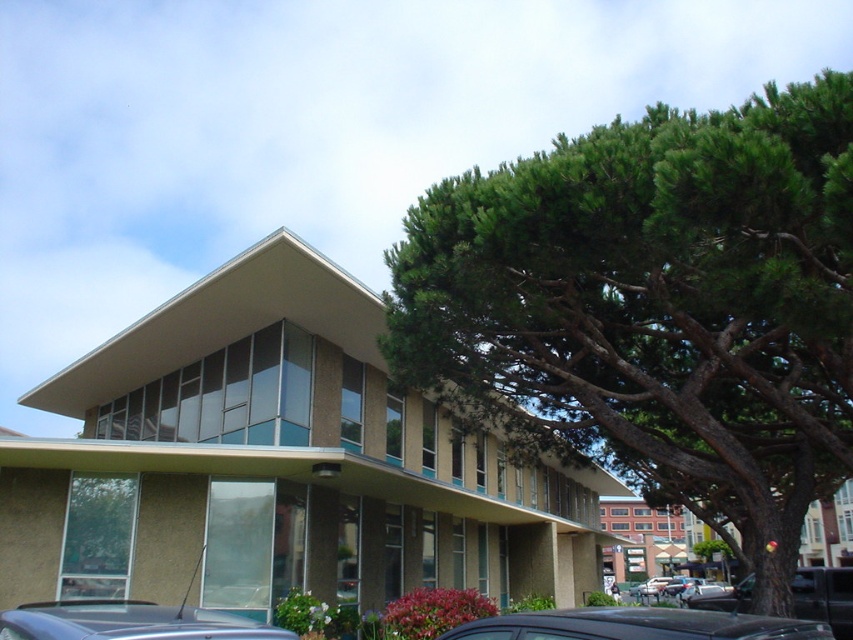
You are a photographer planning to capture the modern building in the image. You notice the green leafy tree at upper right and the black matte car at lower center. Which object takes up more area in the scene?

The black matte car at lower center takes up more area in the scene than the green leafy tree at upper right because the green leafy tree at upper right occupies less space than the black matte car at lower center.

You are a delivery driver approaching the building and need to park between the black matte car at lower center and the metallic gray car at lower left. Can you fit your 2.5 meter wide truck between them?

The black matte car at lower center is to the right of the metallic gray car at lower left, so there is space between them. However, the distance between the cars isn generated in the Objects Description, so we cannot confirm if it is sufficient for a 2.5 meter wide truck. Please check the actual distance before attempting to park.

You are a delivery driver who needs to park your black matte car at lower center near the green leafy tree at upper right. Given that your car requires a parking space of 10 feet, can you safely park your car in the available space between them?

The distance between the green leafy tree at upper right and the black matte car at lower center is 10.16 feet, which is slightly more than the required 10 feet. Therefore, you can safely park your black matte car at lower center near the green leafy tree at upper right.